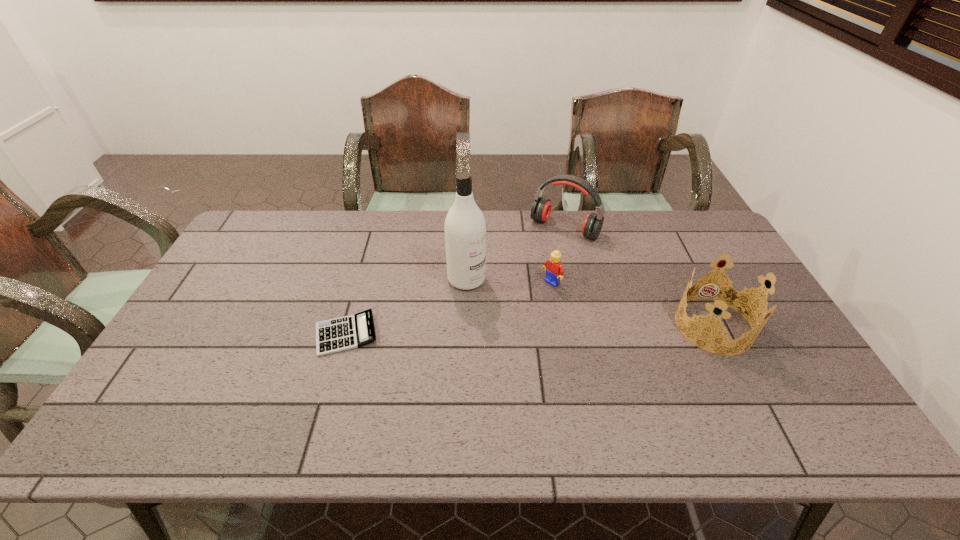
Where is `free space on the desktop that is between the calculator and the crown and is positioned on the front-facing side of the tallest object`? The height and width of the screenshot is (540, 960). free space on the desktop that is between the calculator and the crown and is positioned on the front-facing side of the tallest object is located at coordinates [x=526, y=330].

This screenshot has height=540, width=960. I want to click on vacant space on the desktop that is between the shortest object and the rightmost object and is positioned on the ear cups of the farthest object, so click(487, 331).

Locate an element on the screen. free space on the desktop that is between the leftmost object and the crown and is positioned on the front-facing side of the Lego is located at coordinates [490, 331].